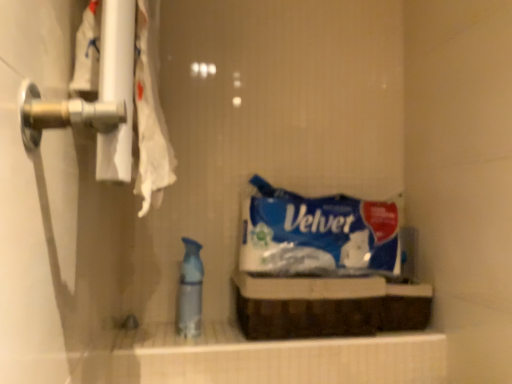
The width and height of the screenshot is (512, 384). Identify the location of vacant space underneath blue paper towel at center (from a real-world perspective). (318, 272).